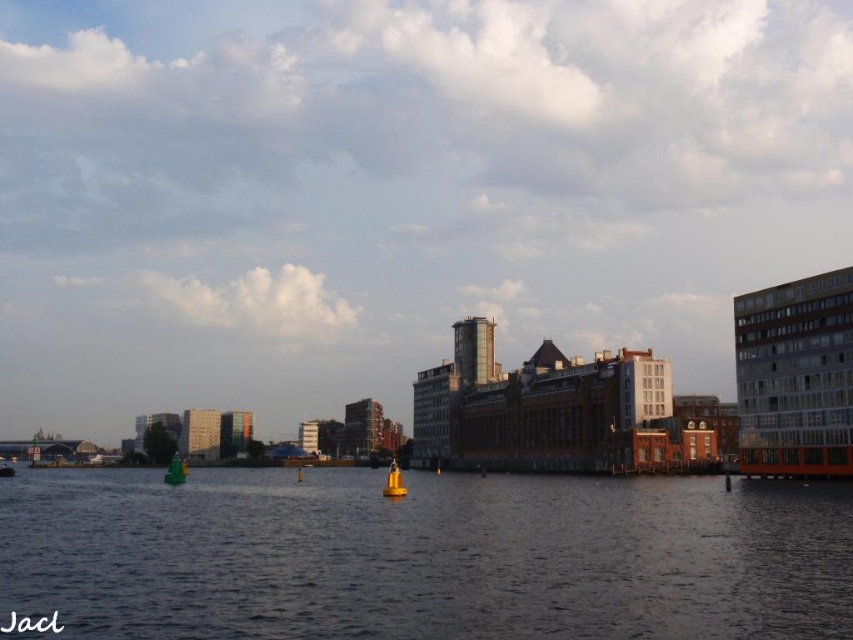
Question: Which of the following is the closest to the observer?

Choices:
 (A) yellow matte buoy at center
 (B) green plastic boat at lower left

Answer: (A)

Question: Is yellow matte buoy at center positioned in front of green plastic boat at lower left?

Choices:
 (A) yes
 (B) no

Answer: (A)

Question: Estimate the real-world distances between objects in this image. Which object is closer to the green plastic boat at lower left?

Choices:
 (A) yellow matte buoy at center
 (B) dark blue water at center

Answer: (A)

Question: Where is dark blue water at center located in relation to yellow matte buoy at center in the image?

Choices:
 (A) above
 (B) below

Answer: (A)

Question: Does dark blue water at center come behind green plastic boat at lower left?

Choices:
 (A) yes
 (B) no

Answer: (B)

Question: Which point is closer to the camera?

Choices:
 (A) yellow matte buoy at center
 (B) dark blue water at center

Answer: (B)